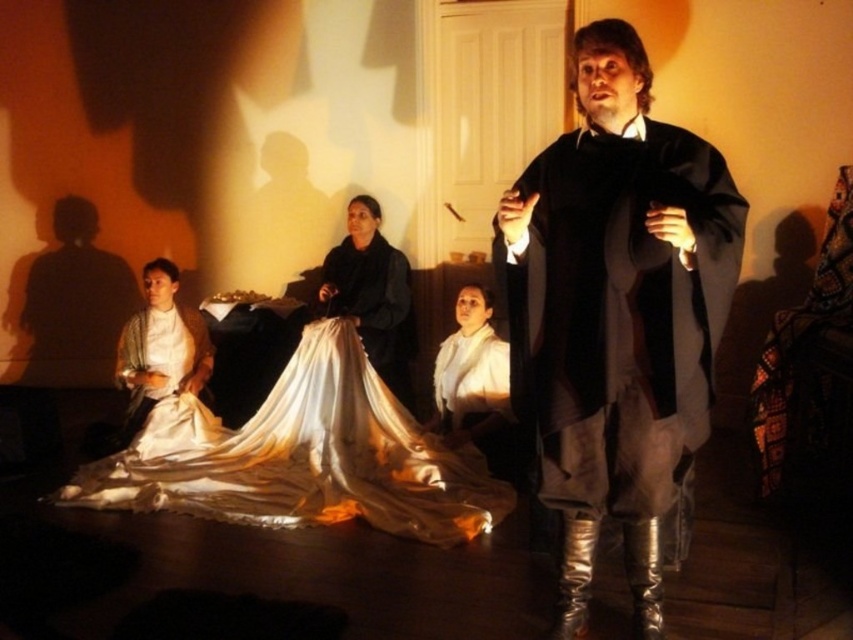
Question: Can you confirm if silky white dress at lower left is positioned to the right of silky white gown at center?

Choices:
 (A) yes
 (B) no

Answer: (B)

Question: Can you confirm if matte black robe at center is positioned to the right of satin white dress at lower left?

Choices:
 (A) no
 (B) yes

Answer: (B)

Question: Can you confirm if silky white dress at lower left is bigger than white satin dress at center?

Choices:
 (A) no
 (B) yes

Answer: (B)

Question: Which object appears closest to the camera in this image?

Choices:
 (A) silky white gown at center
 (B) silky white dress at lower left

Answer: (B)

Question: Which point is farther to the camera?

Choices:
 (A) satin white dress at lower left
 (B) matte black robe at center
 (C) silky white gown at center
 (D) silky white dress at lower left

Answer: (A)

Question: Which object appears closest to the camera in this image?

Choices:
 (A) white satin dress at center
 (B) silky white gown at center
 (C) matte black robe at center

Answer: (C)